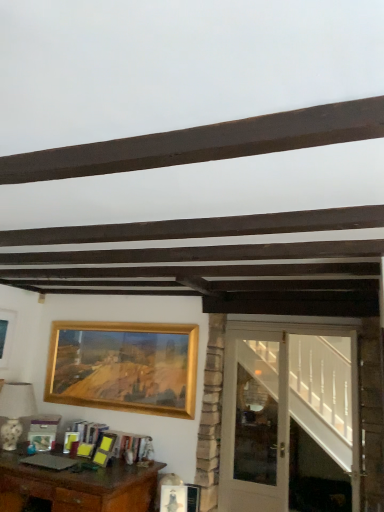
At what (x,y) coordinates should I click in order to perform the action: click on free space above gold metallic picture frame at upper center, which is the 1th picture frame in right-to-left order (from a real-world perspective). Please return your answer as a coordinate pair (x, y). This screenshot has width=384, height=512. Looking at the image, I should click on (101, 323).